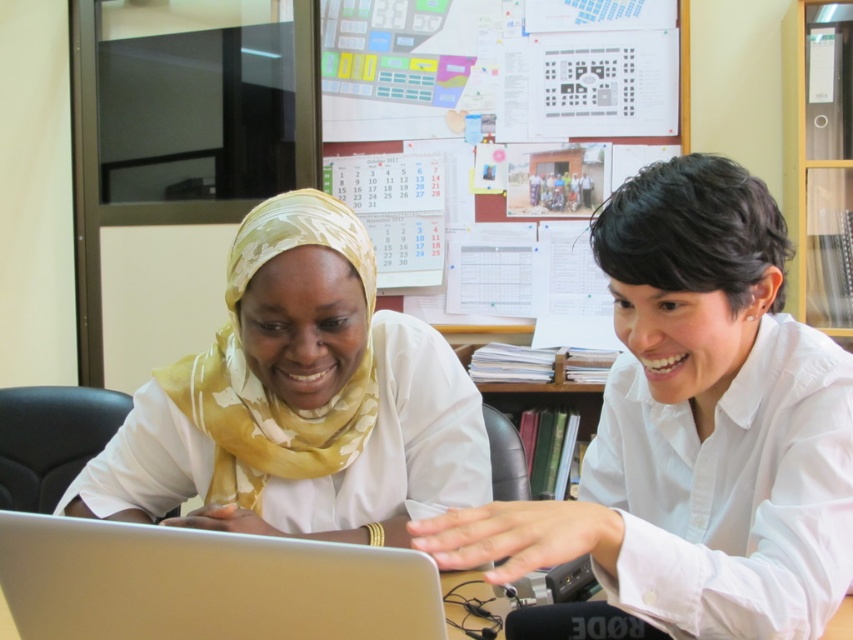
Question: Which point appears closest to the camera in this image?

Choices:
 (A) (407, 500)
 (B) (114, 609)

Answer: (B)

Question: Is white smooth shirt at center bigger than silver metallic laptop at center?

Choices:
 (A) no
 (B) yes

Answer: (B)

Question: Among these points, which one is farthest from the camera?

Choices:
 (A) (228, 452)
 (B) (767, 464)

Answer: (A)

Question: Is white smooth shirt at center wider than silver metallic laptop at center?

Choices:
 (A) no
 (B) yes

Answer: (B)

Question: Can you confirm if yellow floral scarf at center is bigger than silver metallic laptop at center?

Choices:
 (A) no
 (B) yes

Answer: (B)

Question: Which of the following is the closest to the observer?

Choices:
 (A) white smooth shirt at center
 (B) silver metallic laptop at center

Answer: (A)